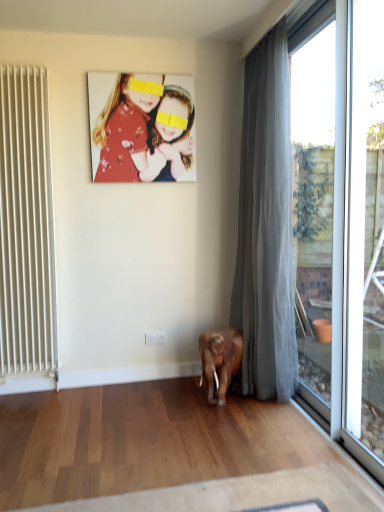
I want to click on vacant region under white matte radiator at left (from a real-world perspective), so click(x=31, y=392).